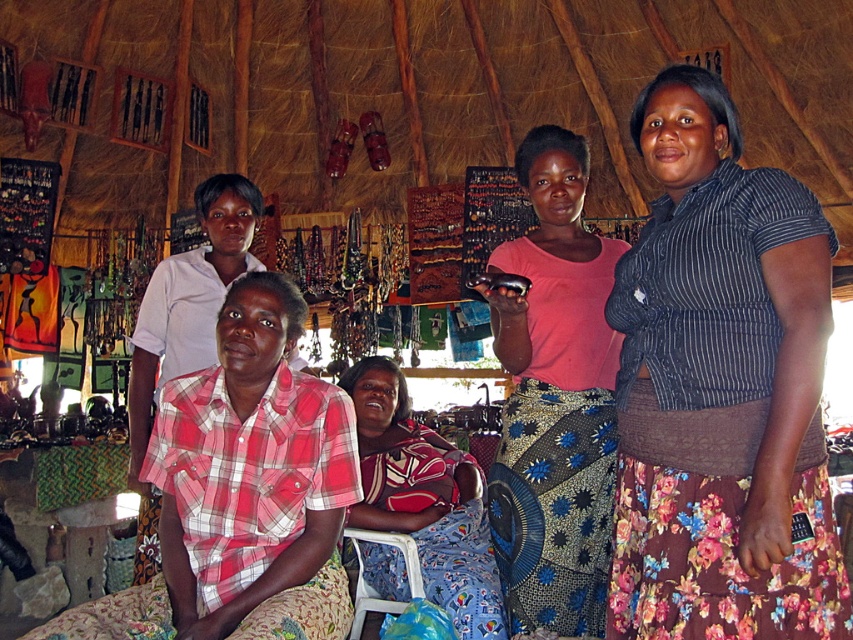
You are a customer in the market and want to buy a plaid cotton shirt. The shop has a thatched roof and displays crafts on racks and hanging from the ceiling. You see a point marked at coordinates [242,492]. Where should you go to find the plaid cotton shirt?

The point at [242,492] indicates the location of the plaid cotton shirt at center, so you should go to the center of the image to find it.

You are trying to decide which shirt to take from the market stall. The plaid cotton shirt at center and the plaid fabric shirt at center are both in your size. However, you need to choose the wider one to match your favorite pants. Which one should you pick?

The plaid cotton shirt at center is wider than plaid fabric shirt at center, so you should choose the plaid cotton shirt at center to match your favorite pants.

You are a tailor measuring fabrics in the market. You have a plaid cotton shirt at center and a pink fabric skirt at center. Which fabric piece is wider?

The plaid cotton shirt at center is wider than the pink fabric skirt at center according to the description.